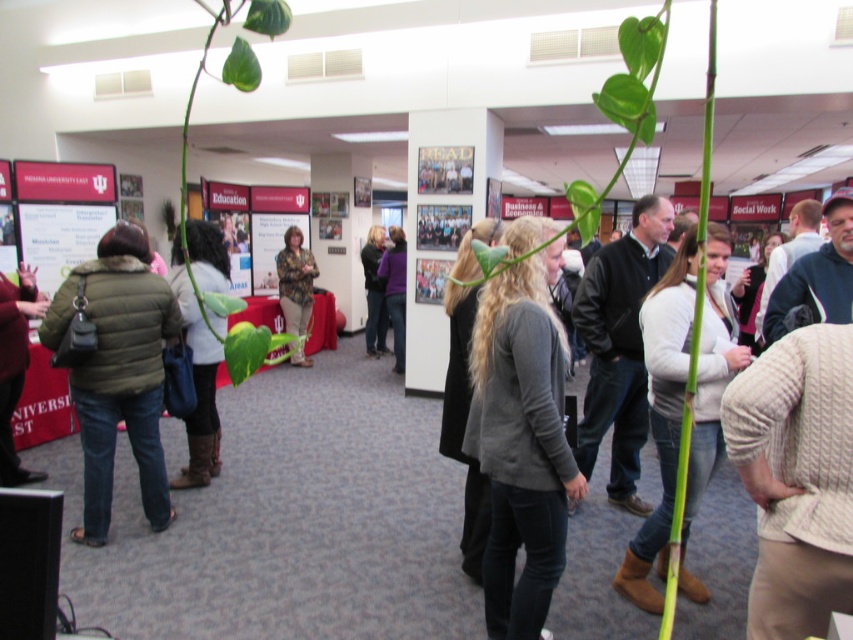
You are organizing a booth at the career fair and need to place both the camouflage jacket at center and the purple matte jacket at center on a narrow shelf. Which jacket should you place first to ensure they both fit?

The purple matte jacket at center has a narrower width than the camouflage jacket at center, so place it first to allow space for the wider camouflage jacket at center.